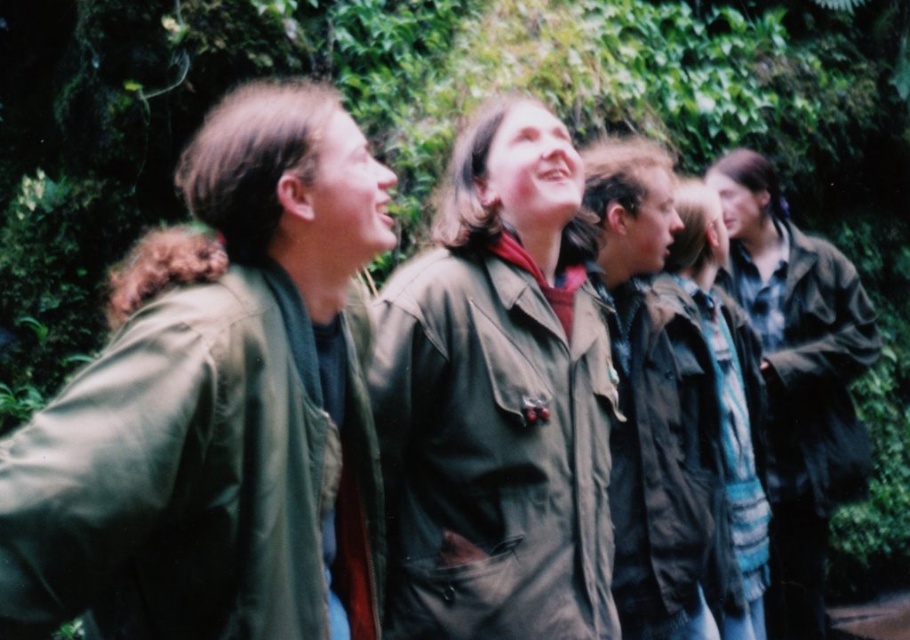
You are a photographer trying to capture a group photo of the green matte trench coat at left and the dark green textured jacket at center. Since you want to ensure both subjects are in the frame, where should you position yourself relative to the group?

You should position yourself to the right of the group so that both the green matte trench coat at left and the dark green textured jacket at center are visible in the frame.

You are an outdoor enthusiast planning to join the group in the forest. You have a backpack that can only hold one jacket. Which jacket between the green canvas jacket at center and the dark green textured jacket at center should you choose if you want the one that is smaller in size?

The green canvas jacket at center has a smaller size compared to the dark green textured jacket at center, so you should choose the green canvas jacket at center.

You are standing in the center of the image. Which direction should you move to reach the green matte trench coat at left?

The green matte trench coat at left is located at coordinates 0.634 on the x axis and 0.240 on the y axis. Since you are at the center, moving towards the left and slightly downward will lead you to the green matte trench coat at left.